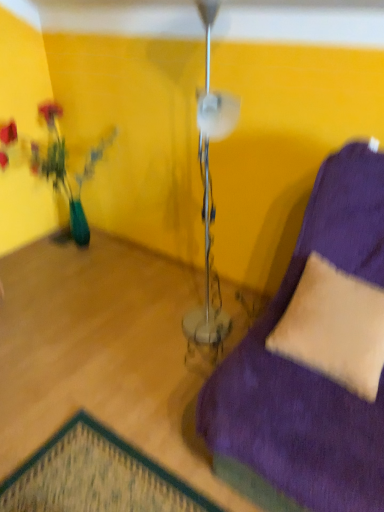
The height and width of the screenshot is (512, 384). What do you see at coordinates (334, 327) in the screenshot?
I see `beige suede pillow at lower right` at bounding box center [334, 327].

Where is `beige suede pillow at lower right`? beige suede pillow at lower right is located at coordinates (334, 327).

Image resolution: width=384 pixels, height=512 pixels. What do you see at coordinates (65, 168) in the screenshot?
I see `teal glass vase at left` at bounding box center [65, 168].

Locate an element on the screen. The image size is (384, 512). teal glass vase at left is located at coordinates (65, 168).

This screenshot has width=384, height=512. What are the coordinates of `beige suede pillow at lower right` in the screenshot? It's located at (334, 327).

Between beige suede pillow at lower right and teal glass vase at left, which one appears on the right side from the viewer's perspective?

beige suede pillow at lower right.

Is beige suede pillow at lower right positioned before teal glass vase at left?

Yes, beige suede pillow at lower right is closer to the camera.

Does point (341, 380) lie in front of point (33, 151)?

Yes, point (341, 380) is in front of point (33, 151).

From the image's perspective, is beige suede pillow at lower right below teal glass vase at left?

Yes.

From a real-world perspective, is beige suede pillow at lower right physically above teal glass vase at left?

Yes, from a real-world perspective, beige suede pillow at lower right is above teal glass vase at left.

In terms of width, does beige suede pillow at lower right look wider or thinner when compared to teal glass vase at left?

Clearly, beige suede pillow at lower right has less width compared to teal glass vase at left.

Which of these two, beige suede pillow at lower right or teal glass vase at left, stands shorter?

beige suede pillow at lower right.

Is beige suede pillow at lower right bigger or smaller than teal glass vase at left?

beige suede pillow at lower right is smaller than teal glass vase at left.

Based on the photo, is beige suede pillow at lower right located outside teal glass vase at left?

beige suede pillow at lower right is positioned outside teal glass vase at left.

Is there a large distance between beige suede pillow at lower right and teal glass vase at left?

beige suede pillow at lower right is far away from teal glass vase at left.

Is beige suede pillow at lower right oriented away from teal glass vase at left?

That's not correct — beige suede pillow at lower right is not looking away from teal glass vase at left.

Can you tell me how much beige suede pillow at lower right and teal glass vase at left differ in facing direction?

95.3 degrees.

Identify the location of pillow that is in front of the teal glass vase at left. (334, 327).

Considering the relative positions of teal glass vase at left and beige suede pillow at lower right in the image provided, is teal glass vase at left to the right of beige suede pillow at lower right from the viewer's perspective?

No, teal glass vase at left is not to the right of beige suede pillow at lower right.

Which object is further away from the camera, teal glass vase at left or beige suede pillow at lower right?

Positioned behind is teal glass vase at left.

Does point (43, 117) lie behind point (362, 348)?

Yes, it is behind point (362, 348).

From the image's perspective, is teal glass vase at left on top of beige suede pillow at lower right?

Yes.

From a real-world perspective, which is physically above, teal glass vase at left or beige suede pillow at lower right?

beige suede pillow at lower right is physically above.

Is teal glass vase at left wider than beige suede pillow at lower right?

Indeed, teal glass vase at left has a greater width compared to beige suede pillow at lower right.

In terms of height, does teal glass vase at left look taller or shorter compared to beige suede pillow at lower right?

In the image, teal glass vase at left appears to be taller than beige suede pillow at lower right.

In the scene shown: Is teal glass vase at left bigger than beige suede pillow at lower right?

Indeed, teal glass vase at left has a larger size compared to beige suede pillow at lower right.

Is teal glass vase at left not inside beige suede pillow at lower right?

Yes, teal glass vase at left is located beyond the bounds of beige suede pillow at lower right.

Are teal glass vase at left and beige suede pillow at lower right far apart?

teal glass vase at left is far away from beige suede pillow at lower right.

Is beige suede pillow at lower right at the back of teal glass vase at left?

That's not correct — teal glass vase at left is not looking away from beige suede pillow at lower right.

How different are the orientations of teal glass vase at left and beige suede pillow at lower right in degrees?

The angular difference between teal glass vase at left and beige suede pillow at lower right is 95.3 degrees.

Find the location of `pillow to the right of teal glass vase at left`. pillow to the right of teal glass vase at left is located at coordinates (334, 327).

Where is `pillow located below the teal glass vase at left (from the image's perspective)`? pillow located below the teal glass vase at left (from the image's perspective) is located at coordinates (334, 327).

The width and height of the screenshot is (384, 512). Identify the location of pillow above the teal glass vase at left (from a real-world perspective). (334, 327).